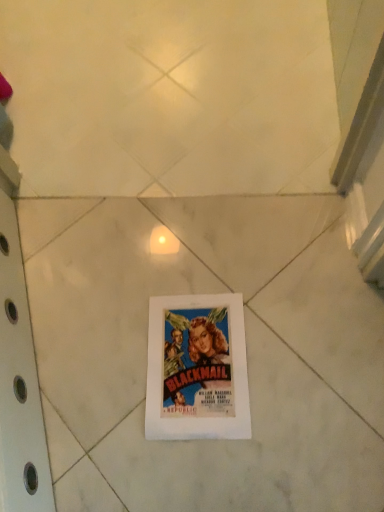
Locate an element on the screen. The height and width of the screenshot is (512, 384). free point in front of white paper at center is located at coordinates (243, 467).